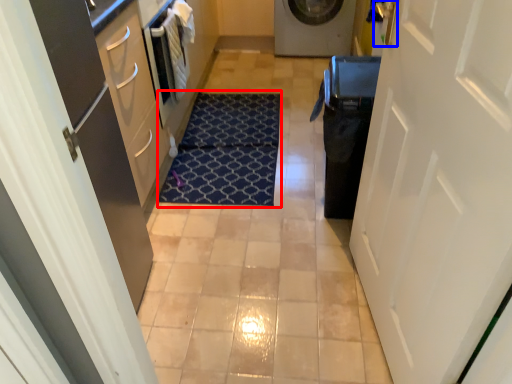
Question: Which object appears farthest to the camera in this image, doormat (highlighted by a red box) or door handle (highlighted by a blue box)?

Choices:
 (A) doormat
 (B) door handle

Answer: (A)